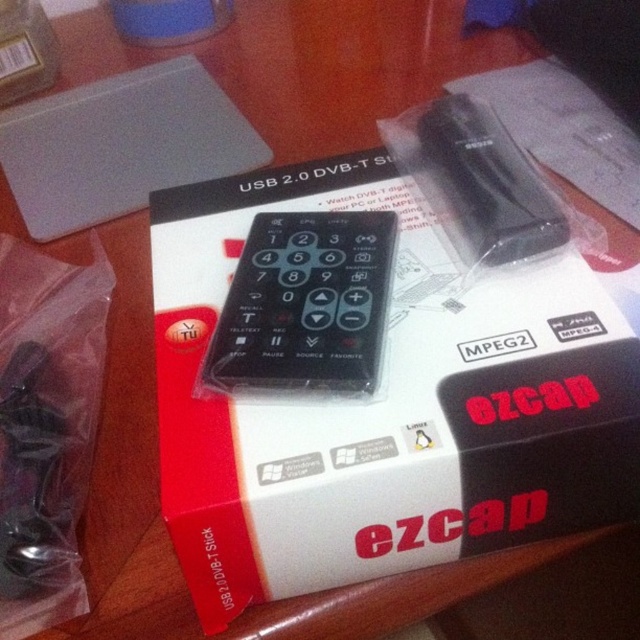
You are trying to choose a remote control to use with your TV. You have two options in the image, the black matte remote at center and the black plastic remote at upper center. Which remote is wider?

The black matte remote at center might be wider than the black plastic remote at upper center.

You are holding the remote control on top of the box and want to press a button. If you have to choose between the point at coordinates point (397, 304) and point (509, 225), which one is closer to your hand?

The point at coordinates point (397, 304) is closer to the viewer than point (509, 225), so you should press that one first.

You are trying to choose a remote control to use with your TV. You have two options in the image, the black matte remote at center and the black plastic remote at upper center. Which remote is bigger?

The black matte remote at center is larger in size compared to the black plastic remote at upper center.